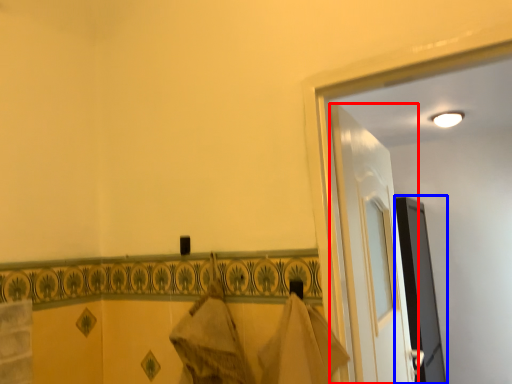
Question: Which object appears closest to the camera in this image, door (highlighted by a red box) or screen door (highlighted by a blue box)?

Choices:
 (A) door
 (B) screen door

Answer: (A)